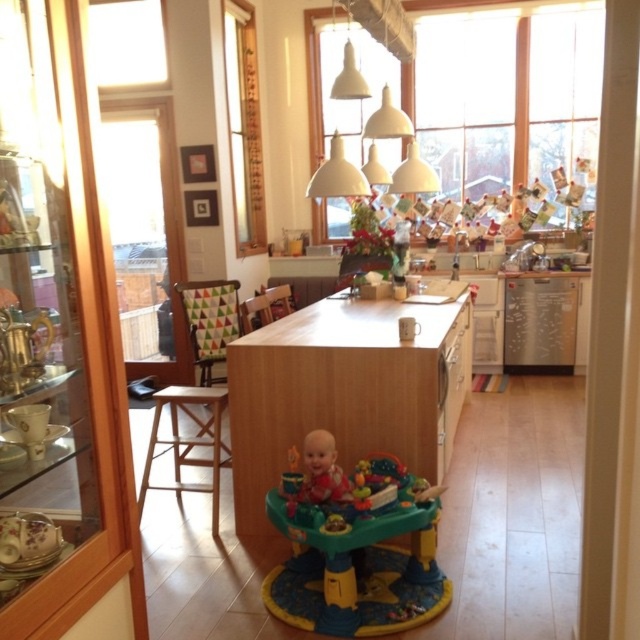
Question: Which point is closer to the camera?

Choices:
 (A) multicolored plastic walker at center
 (B) triangular-patterned fabric chair at left

Answer: (A)

Question: Which object is farther from the camera taking this photo?

Choices:
 (A) multicolored plastic walker at center
 (B) triangular-patterned fabric chair at left
 (C) wooden textured chair at center

Answer: (B)

Question: Can you confirm if matte red baby walker at center is wider than wooden textured chair at center?

Choices:
 (A) no
 (B) yes

Answer: (A)

Question: Does multicolored plastic walker at center lie behind triangular-patterned fabric chair at left?

Choices:
 (A) no
 (B) yes

Answer: (A)

Question: Which of the following is the farthest from the observer?

Choices:
 (A) pos(269,308)
 (B) pos(314,477)
 (C) pos(348,552)
 (D) pos(202,285)

Answer: (D)

Question: Can you confirm if matte red baby walker at center is positioned to the right of wooden textured chair at center?

Choices:
 (A) no
 (B) yes

Answer: (B)